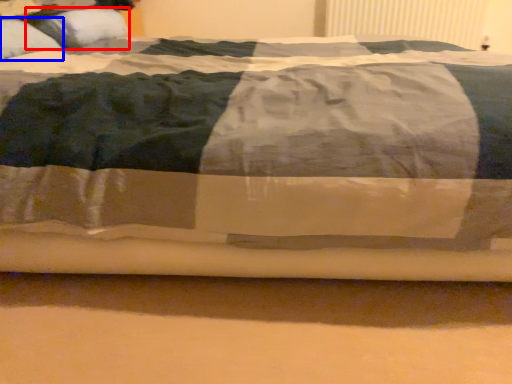
Question: Which point is closer to the camera, pillow (highlighted by a red box) or pillow (highlighted by a blue box)?

Choices:
 (A) pillow
 (B) pillow

Answer: (B)